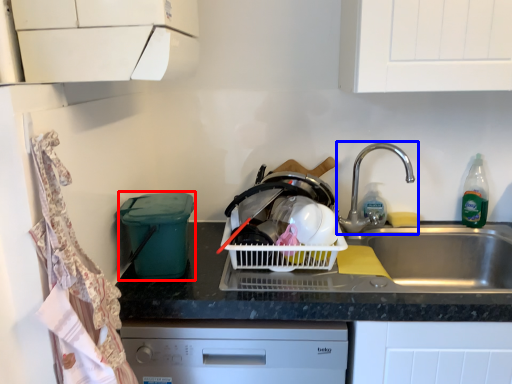
Question: Among these objects, which one is farthest to the camera, appliance (highlighted by a red box) or tap (highlighted by a blue box)?

Choices:
 (A) appliance
 (B) tap

Answer: (B)